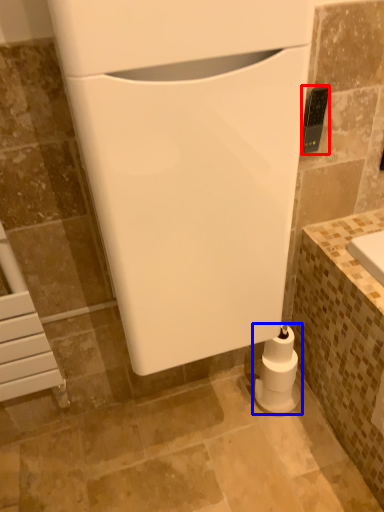
Question: Among these objects, which one is farthest to the camera, appliance (highlighted by a red box) or toilet paper (highlighted by a blue box)?

Choices:
 (A) appliance
 (B) toilet paper

Answer: (B)